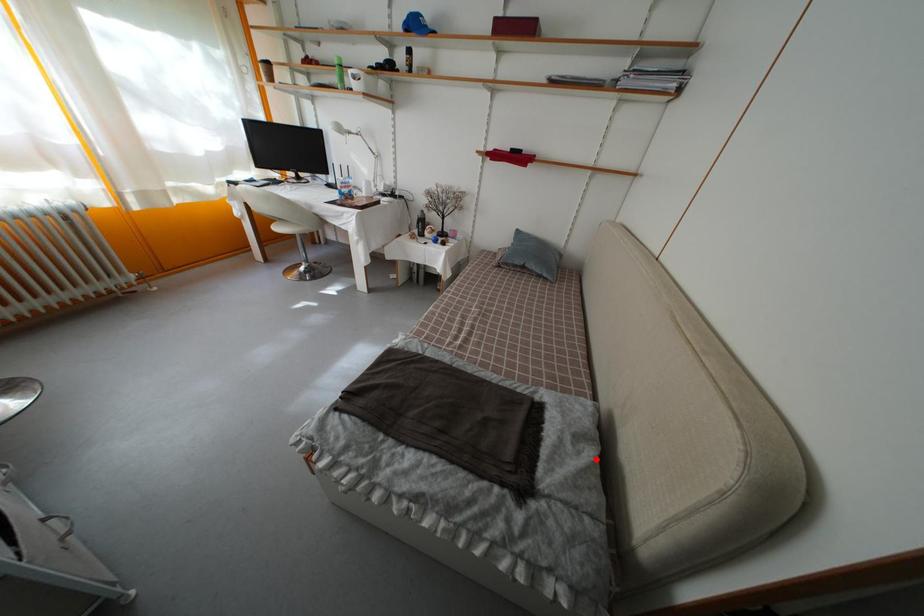
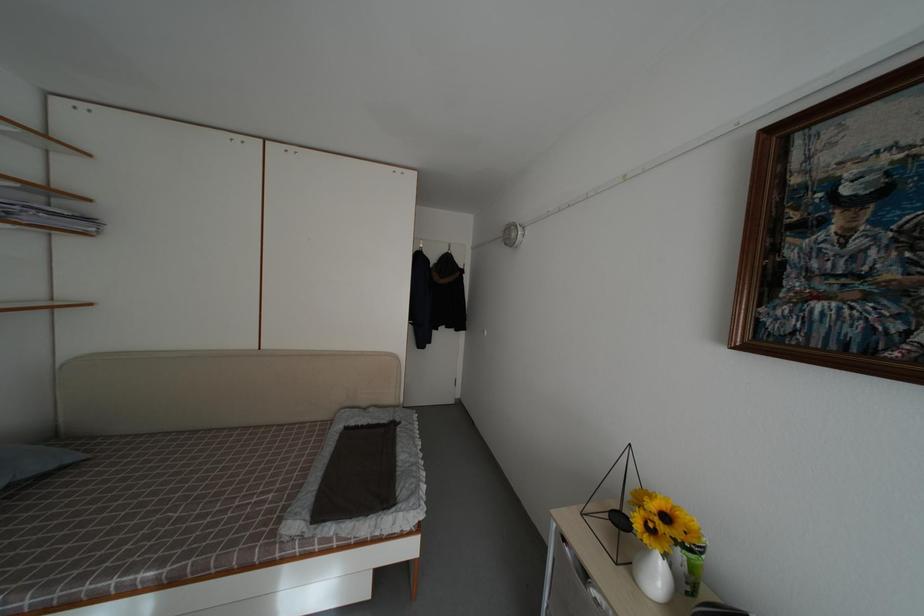
Locate, in the second image, the point that corresponds to the highlighted location in the first image.

(378, 416)